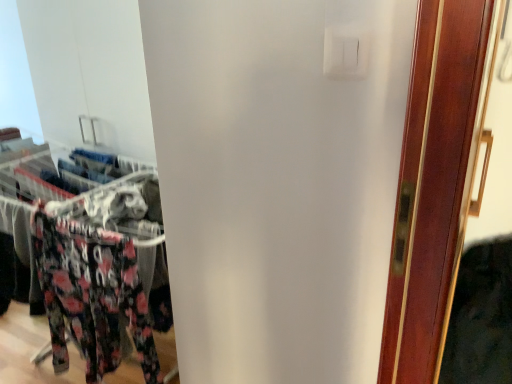
Question: From a real-world perspective, is floral fabric pants at left physically located above or below white plastic light switch at upper center?

Choices:
 (A) below
 (B) above

Answer: (A)

Question: Is floral fabric pants at left bigger or smaller than white plastic light switch at upper center?

Choices:
 (A) big
 (B) small

Answer: (A)

Question: Choose the correct answer: Is floral fabric pants at left inside white plastic light switch at upper center or outside it?

Choices:
 (A) inside
 (B) outside

Answer: (B)

Question: Would you say white plastic light switch at upper center is inside or outside floral fabric pants at left?

Choices:
 (A) outside
 (B) inside

Answer: (A)

Question: Is point (328, 69) positioned closer to the camera than point (10, 208)?

Choices:
 (A) farther
 (B) closer

Answer: (B)

Question: From a real-world perspective, is white plastic light switch at upper center physically located above or below floral fabric pants at left?

Choices:
 (A) above
 (B) below

Answer: (A)

Question: From the image's perspective, is white plastic light switch at upper center located above or below floral fabric pants at left?

Choices:
 (A) below
 (B) above

Answer: (B)